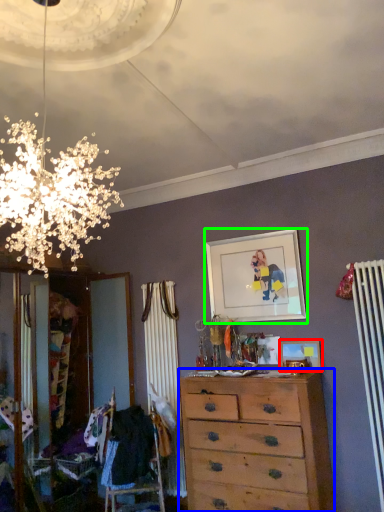
Question: Which object is the closest to the picture frame (highlighted by a red box)? Choose among these: chest of drawers (highlighted by a blue box) or picture frame (highlighted by a green box).

Choices:
 (A) chest of drawers
 (B) picture frame

Answer: (B)